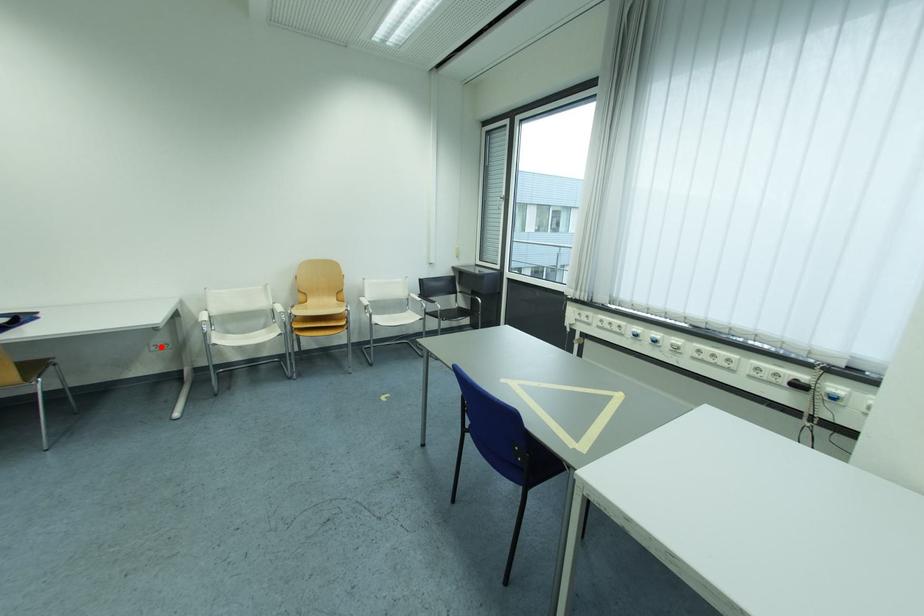
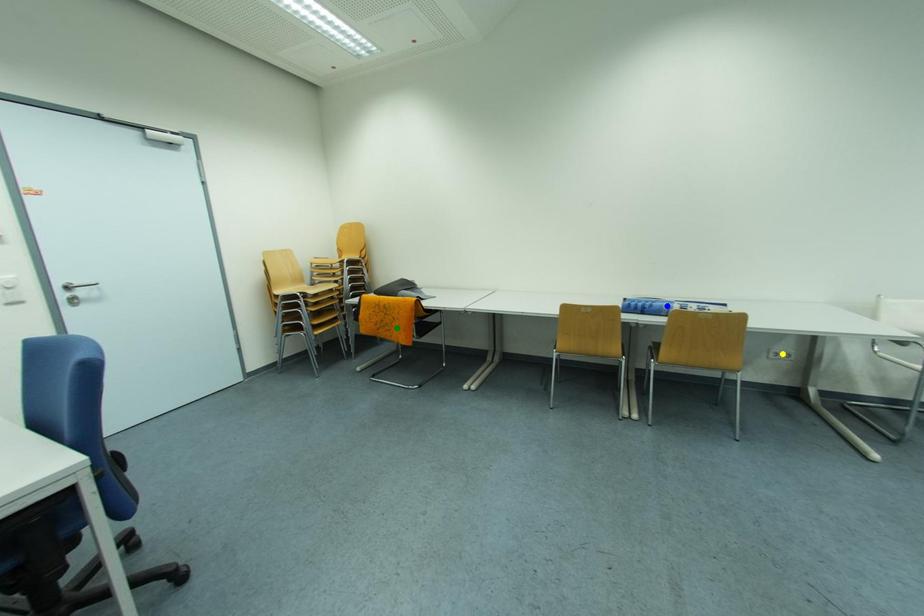
Question: I am providing you with two images of the same scene from different viewpoints. A red point is marked on the first image. You are given multiple points on the second image. Which point in image 2 is actually the same real-world point as the red point in image 1?

Choices:
 (A) yellow point
 (B) green point
 (C) blue point

Answer: (A)